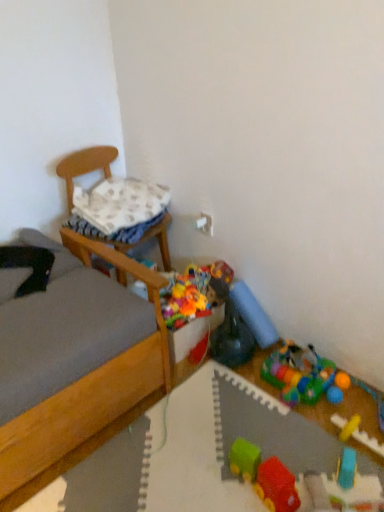
At what (x,y) coordinates should I click in order to perform the action: click on vacant area that lies between blue rubber toy at lower right, which is the fourth toy in back-to-front order, and rubberized plastic play mat at lower right, placed as the 4th toy when sorted from front to back. Please return your answer as a coordinate pair (x, y). The height and width of the screenshot is (512, 384). Looking at the image, I should click on (317, 426).